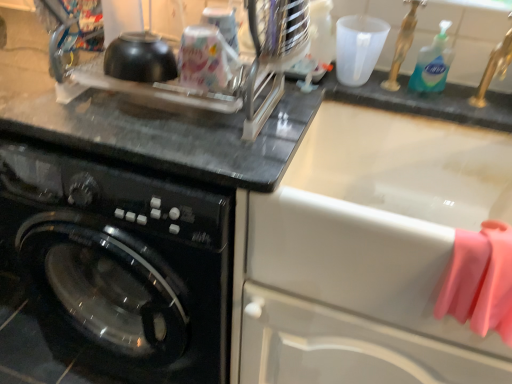
Describe the element at coordinates (369, 253) in the screenshot. I see `white glossy sink at upper right` at that location.

What is the approximate height of black glossy washing machine at left?

black glossy washing machine at left is 32.66 inches in height.

You are a GUI agent. You are given a task and a screenshot of the screen. Output one action in this format:
    pyautogui.click(x=<x>, y=<y>)
    Task: Click on the pink rubber gloves at right
    
    Given the screenshot: What is the action you would take?
    pyautogui.click(x=480, y=280)

Is pink rubber gloves at right oriented away from blue liquid soap at upper right?

Yes, blue liquid soap at upper right is at the back of pink rubber gloves at right.

Is pink rubber gloves at right placed right next to blue liquid soap at upper right?

pink rubber gloves at right is not next to blue liquid soap at upper right, and they're not touching.

Which object is more forward, pink rubber gloves at right or blue liquid soap at upper right?

pink rubber gloves at right.

Considering the relative positions of pink rubber gloves at right and white glossy sink at upper right in the image provided, is pink rubber gloves at right to the left of white glossy sink at upper right from the viewer's perspective?

In fact, pink rubber gloves at right is to the right of white glossy sink at upper right.

Is pink rubber gloves at right wider or thinner than white glossy sink at upper right?

Considering their sizes, pink rubber gloves at right looks slimmer than white glossy sink at upper right.

Is pink rubber gloves at right next to white glossy sink at upper right?

pink rubber gloves at right and white glossy sink at upper right are clearly separated.

Considering the sizes of objects blue liquid soap at upper right and white glossy sink at upper right in the image provided, who is smaller, blue liquid soap at upper right or white glossy sink at upper right?

blue liquid soap at upper right is smaller.

Is blue liquid soap at upper right not within white glossy sink at upper right?

Actually, blue liquid soap at upper right is at least partially inside white glossy sink at upper right.

Is blue liquid soap at upper right shorter than white glossy sink at upper right?

Yes.

Relative to white glossy sink at upper right, is blue liquid soap at upper right in front or behind?

blue liquid soap at upper right is positioned farther from the viewer than white glossy sink at upper right.

Find the location of a particular element. The height and width of the screenshot is (384, 512). sink below the blue liquid soap at upper right (from a real-world perspective) is located at coordinates (369, 253).

Is blue liquid soap at upper right located within white glossy sink at upper right?

Yes, blue liquid soap at upper right is a part of white glossy sink at upper right.

Considering the positions of objects white glossy sink at upper right and blue liquid soap at upper right in the image provided, who is behind, white glossy sink at upper right or blue liquid soap at upper right?

blue liquid soap at upper right is more distant.

Is white glossy sink at upper right not near blue liquid soap at upper right?

No.

Is pink rubber gloves at right at the back of black glossy washing machine at left?

No, black glossy washing machine at left is not facing the opposite direction of pink rubber gloves at right.

Does black glossy washing machine at left have a smaller size compared to pink rubber gloves at right?

Incorrect, black glossy washing machine at left is not smaller in size than pink rubber gloves at right.

Looking at this image, between black glossy washing machine at left and pink rubber gloves at right, which one has more height?

With more height is black glossy washing machine at left.

Which object is thinner, black glossy washing machine at left or pink rubber gloves at right?

pink rubber gloves at right is thinner.

Is blue liquid soap at upper right not near pink rubber gloves at right?

No.

From the image's perspective, is blue liquid soap at upper right beneath pink rubber gloves at right?

No.

Considering the sizes of objects blue liquid soap at upper right and pink rubber gloves at right in the image provided, who is wider, blue liquid soap at upper right or pink rubber gloves at right?

With larger width is pink rubber gloves at right.

Find the location of a particular element. This screenshot has width=512, height=384. clothe in front of the blue liquid soap at upper right is located at coordinates (480, 280).

Which of these two, black glossy washing machine at left or blue liquid soap at upper right, is wider?

Wider between the two is black glossy washing machine at left.

Considering the sizes of objects black glossy washing machine at left and blue liquid soap at upper right in the image provided, who is smaller, black glossy washing machine at left or blue liquid soap at upper right?

With smaller size is blue liquid soap at upper right.

In the scene shown: Is black glossy washing machine at left looking in the opposite direction of blue liquid soap at upper right?

black glossy washing machine at left does not have its back to blue liquid soap at upper right.

From the picture: Would you consider black glossy washing machine at left to be distant from blue liquid soap at upper right?

No.

This screenshot has width=512, height=384. Find the location of `clothe below the blue liquid soap at upper right (from a real-world perspective)`. clothe below the blue liquid soap at upper right (from a real-world perspective) is located at coordinates (480, 280).

You are a GUI agent. You are given a task and a screenshot of the screen. Output one action in this format:
    pyautogui.click(x=<x>, y=<y>)
    Task: Click on the sink above the pink rubber gloves at right (from the image's perspective)
    
    Given the screenshot: What is the action you would take?
    pyautogui.click(x=369, y=253)

Based on their spatial positions, is pink rubber gloves at right or blue liquid soap at upper right further from white glossy sink at upper right?

The object further to white glossy sink at upper right is blue liquid soap at upper right.

Based on their spatial positions, is black glossy washing machine at left or blue liquid soap at upper right closer to white glossy sink at upper right?

Based on the image, black glossy washing machine at left appears to be nearer to white glossy sink at upper right.

Based on their spatial positions, is pink rubber gloves at right or white glossy sink at upper right closer to black glossy washing machine at left?

white glossy sink at upper right is positioned closer to the anchor black glossy washing machine at left.

Based on their spatial positions, is white glossy sink at upper right or pink rubber gloves at right further from black glossy washing machine at left?

The object further to black glossy washing machine at left is pink rubber gloves at right.

Estimate the real-world distances between objects in this image. Which object is closer to pink rubber gloves at right, black glossy washing machine at left or white glossy sink at upper right?

white glossy sink at upper right lies closer to pink rubber gloves at right than the other object.

Considering their positions, is white glossy sink at upper right positioned further to blue liquid soap at upper right than black glossy washing machine at left?

black glossy washing machine at left lies further to blue liquid soap at upper right than the other object.

From the image, which object appears to be nearer to white glossy sink at upper right, black glossy washing machine at left or pink rubber gloves at right?

Based on the image, pink rubber gloves at right appears to be nearer to white glossy sink at upper right.

Based on the photo, looking at the image, which one is located closer to blue liquid soap at upper right, black glossy washing machine at left or white glossy sink at upper right?

white glossy sink at upper right is positioned closer to the anchor blue liquid soap at upper right.

Locate an element on the screen. sink located between black glossy washing machine at left and pink rubber gloves at right in the left-right direction is located at coordinates (369, 253).

The image size is (512, 384). What are the coordinates of `clothe located between white glossy sink at upper right and blue liquid soap at upper right in the depth direction` in the screenshot? It's located at click(x=480, y=280).

At what (x,y) coordinates should I click in order to perform the action: click on sink between black glossy washing machine at left and blue liquid soap at upper right in the horizontal direction. Please return your answer as a coordinate pair (x, y). This screenshot has width=512, height=384. Looking at the image, I should click on (369, 253).

Where is `clothe located between black glossy washing machine at left and blue liquid soap at upper right in the left-right direction`? The width and height of the screenshot is (512, 384). clothe located between black glossy washing machine at left and blue liquid soap at upper right in the left-right direction is located at coordinates (480, 280).